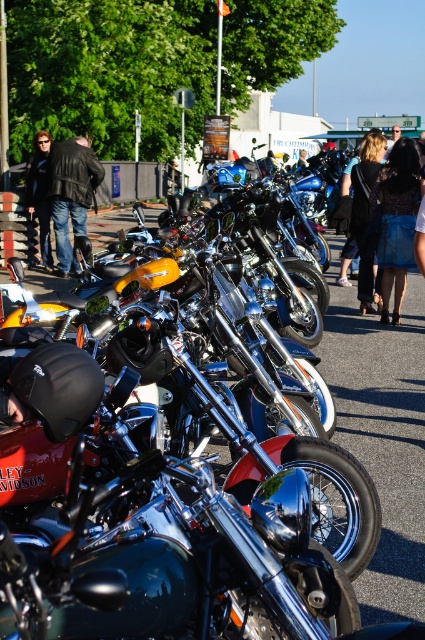
Question: Which point appears closest to the camera in this image?

Choices:
 (A) (70, 195)
 (B) (119, 563)

Answer: (B)

Question: Which object is closer to the camera taking this photo?

Choices:
 (A) blue fabric bag at center
 (B) dark brown leather jacket at center

Answer: (A)

Question: Estimate the real-world distances between objects in this image. Which object is farther from the dark brown leather jacket at center?

Choices:
 (A) leather jacket at left
 (B) matte black jacket at left

Answer: (B)

Question: Observing the image, what is the correct spatial positioning of blue fabric bag at center in reference to dark brown leather jacket at center?

Choices:
 (A) left
 (B) right

Answer: (B)

Question: Does leather jacket at left appear under dark brown leather jacket at center?

Choices:
 (A) yes
 (B) no

Answer: (B)

Question: Does blue fabric bag at center appear under leather jacket at left?

Choices:
 (A) no
 (B) yes

Answer: (B)